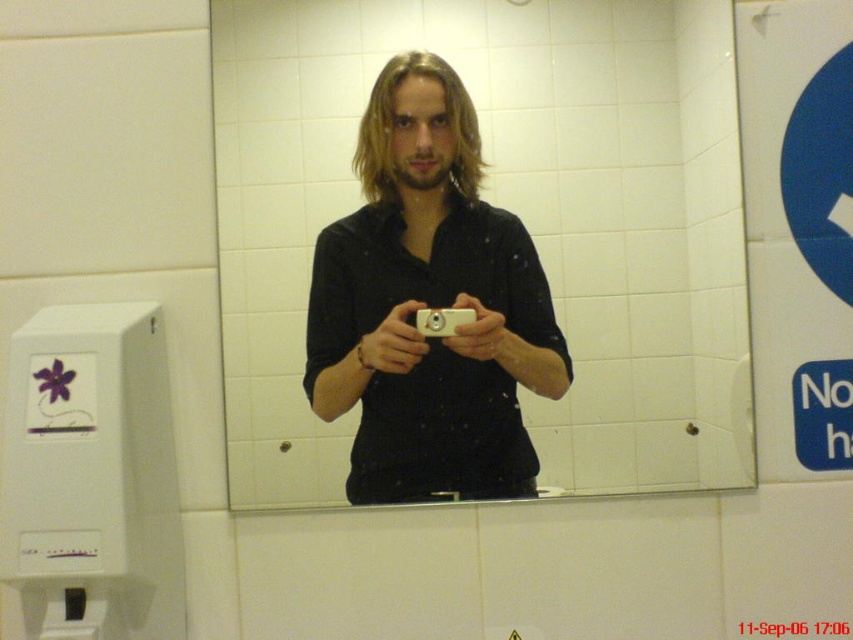
You are standing in a public restroom and want to take a selfie with your phone. You notice a point at coordinates (219, 49) in the frame. If you need to be at least 24 inches away from this point to avoid blurriness, are you within the safe distance?

The distance of point (219, 49) from viewer is 31.11 inches, so yes, you are within the safe distance since 31.11 inches is greater than 24 inches.

You are trying to take a selfie in the restroom and want to frame your shot so that both the white glossy mirror at center and the white plastic camera at center are visible. Which object should you position closer to the edge of the frame to ensure both are included?

Since the white glossy mirror at center is to the right of the white plastic camera at center, you should position the white glossy mirror at center closer to the right edge of the frame to include both objects in the shot.

Consider the image. You are a photographer trying to frame a shot of the person taking a selfie in the restroom. The person is holding a matte black camera at center. If you want to position your camera directly behind the person so that their reflection in the mirror is centered in your viewfinder, where should you aim your camera? Provide coordinates in the format x,y between 0 and 1.

The matte black camera at center is located at coordinates point [428,305]. To center the reflection in your viewfinder, aim your camera at the same coordinates.